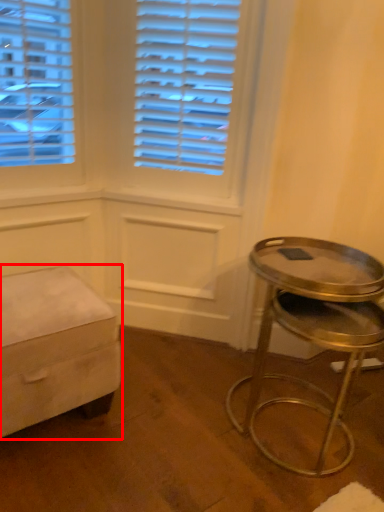
Question: From the image's perspective, what is the correct spatial positioning of furniture (annotated by the red box) in reference to stool?

Choices:
 (A) above
 (B) below

Answer: (A)